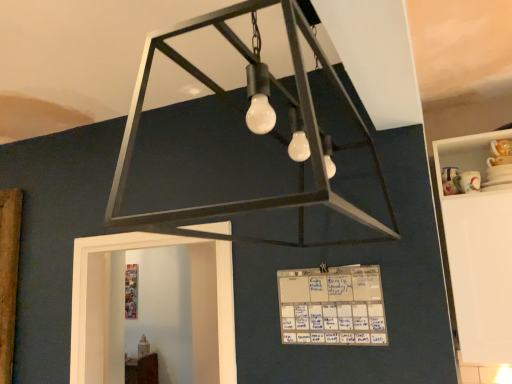
Question: Does white glossy cabinet at right turn towards matte black chandelier at center?

Choices:
 (A) no
 (B) yes

Answer: (A)

Question: Does white glossy cabinet at right have a lesser width compared to matte black chandelier at center?

Choices:
 (A) no
 (B) yes

Answer: (B)

Question: Is matte black chandelier at center a part of white glossy cabinet at right?

Choices:
 (A) yes
 (B) no

Answer: (B)

Question: Is white glossy cabinet at right not close to matte black chandelier at center?

Choices:
 (A) no
 (B) yes

Answer: (A)

Question: Is white glossy cabinet at right placed right next to matte black chandelier at center?

Choices:
 (A) yes
 (B) no

Answer: (B)

Question: Can you confirm if white glossy cabinet at right is wider than matte black chandelier at center?

Choices:
 (A) yes
 (B) no

Answer: (B)

Question: Is white paper calendar at center aimed at matte black chandelier at center?

Choices:
 (A) no
 (B) yes

Answer: (A)

Question: From a real-world perspective, is white paper calendar at center positioned under matte black chandelier at center based on gravity?

Choices:
 (A) no
 (B) yes

Answer: (B)

Question: Does white paper calendar at center lie in front of matte black chandelier at center?

Choices:
 (A) yes
 (B) no

Answer: (B)

Question: Is white paper calendar at center directly adjacent to matte black chandelier at center?

Choices:
 (A) no
 (B) yes

Answer: (A)

Question: Is white paper calendar at center looking in the opposite direction of matte black chandelier at center?

Choices:
 (A) yes
 (B) no

Answer: (B)

Question: Does white paper calendar at center have a greater width compared to matte black chandelier at center?

Choices:
 (A) no
 (B) yes

Answer: (A)

Question: Is white glossy cabinet at right positioned in front of white paper calendar at center?

Choices:
 (A) yes
 (B) no

Answer: (B)